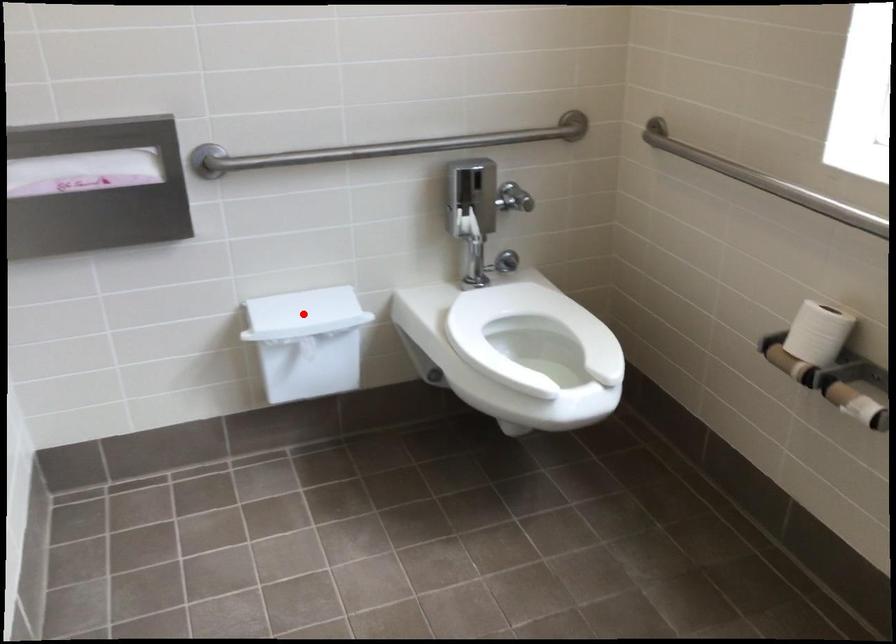
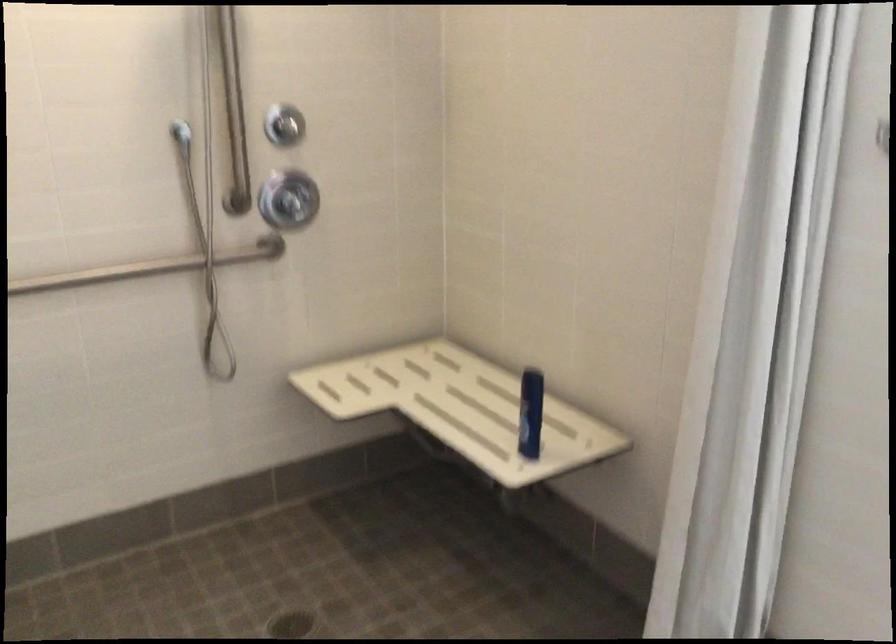
Question: I am providing you with two images of the same scene from different viewpoints. A red point is marked on the first image. Can you still see the location of the red point in image 2?

Choices:
 (A) Yes
 (B) No

Answer: (B)